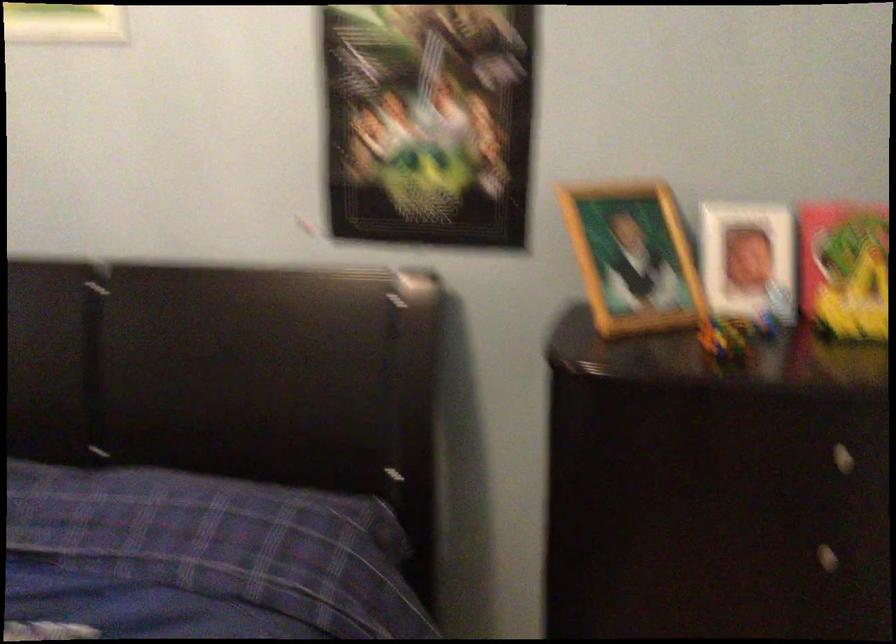
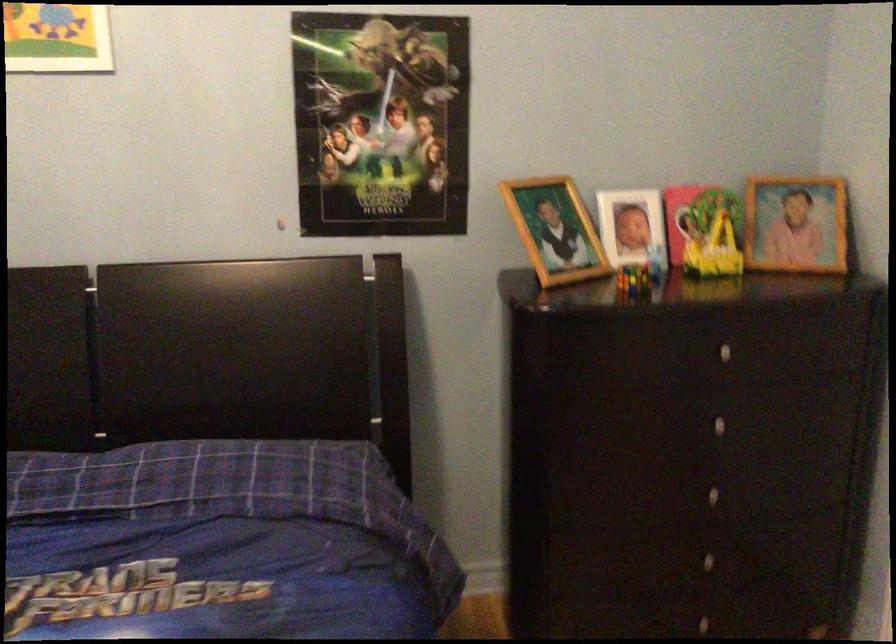
The point at (x=631, y=258) is marked in the first image. Where is the corresponding point in the second image?

(555, 230)